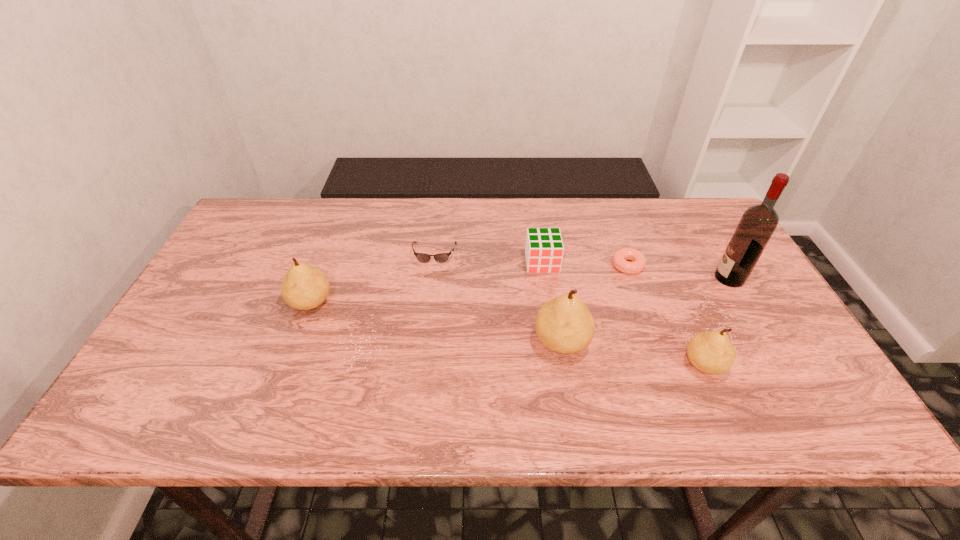
The width and height of the screenshot is (960, 540). In order to click on the second tallest pear in this screenshot , I will do (304, 287).

Find the location of `the farthest pear`. the farthest pear is located at coordinates (304, 287).

Image resolution: width=960 pixels, height=540 pixels. In order to click on the second pear from left to right in this screenshot , I will do `click(564, 324)`.

Identify the location of the fourth shortest object. (711, 352).

In order to click on the second object from right to left in this screenshot , I will do `click(711, 352)`.

You are a GUI agent. You are given a task and a screenshot of the screen. Output one action in this format:
    pyautogui.click(x=<x>, y=<y>)
    Task: Click on the alcohol
    The width and height of the screenshot is (960, 540).
    Given the screenshot: What is the action you would take?
    pyautogui.click(x=758, y=223)

I want to click on the tallest object, so click(x=758, y=223).

This screenshot has height=540, width=960. What are the coordinates of `the shortest object` in the screenshot? It's located at (638, 263).

Image resolution: width=960 pixels, height=540 pixels. In order to click on doughnut in this screenshot , I will do `click(638, 263)`.

This screenshot has width=960, height=540. What are the coordinates of `cube` in the screenshot? It's located at (544, 249).